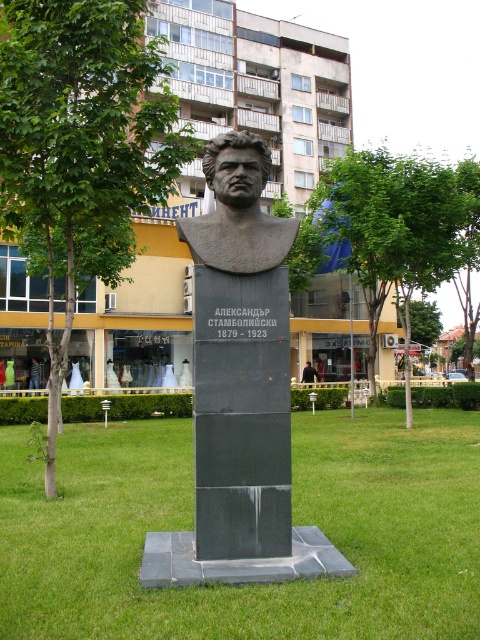
Is black granite bust at center to the left of matte black bust at center from the viewer's perspective?

No, black granite bust at center is not to the left of matte black bust at center.

Can you confirm if black granite bust at center is wider than matte black bust at center?

Correct, the width of black granite bust at center exceeds that of matte black bust at center.

I want to click on black granite bust at center, so click(240, 384).

Is green grass at center wider than slate gray stone bust at center?

Yes, green grass at center is wider than slate gray stone bust at center.

Is point (188, 621) positioned after point (225, 218)?

No.

The image size is (480, 640). Describe the element at coordinates (292, 518) in the screenshot. I see `green grass at center` at that location.

You are a GUI agent. You are given a task and a screenshot of the screen. Output one action in this format:
    pyautogui.click(x=<x>, y=<y>)
    Task: Click on the green grass at center
    The image size is (480, 640).
    Given the screenshot: What is the action you would take?
    pyautogui.click(x=292, y=518)

Does green grass at center have a lesser height compared to green leafy tree at left?

Correct, green grass at center is not as tall as green leafy tree at left.

Between point (25, 618) and point (62, 112), which one is positioned in front?

Point (25, 618) is more forward.

Locate an element on the screen. The height and width of the screenshot is (640, 480). green grass at center is located at coordinates (292, 518).